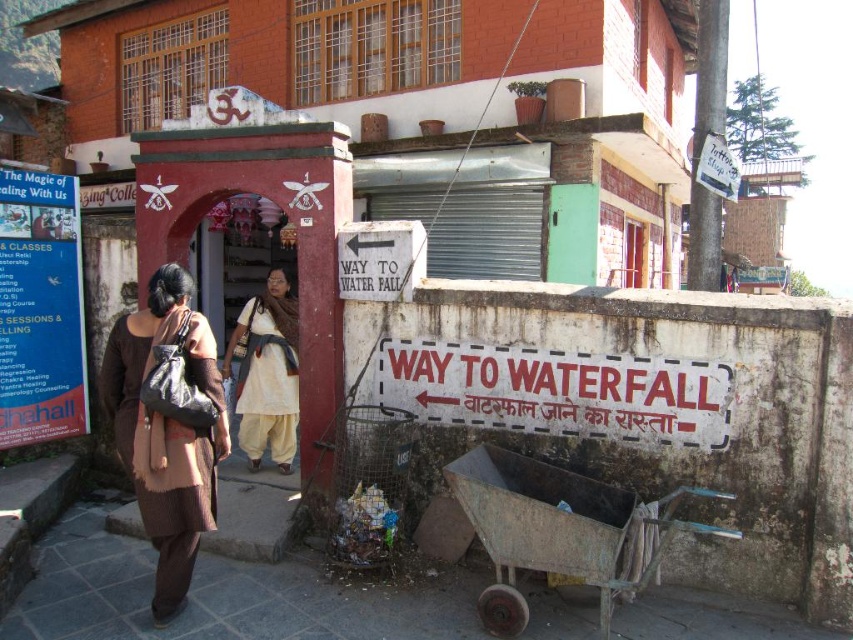
Does rusty metal cart at lower center have a smaller size compared to white cotton dress at center?

No, rusty metal cart at lower center is not smaller than white cotton dress at center.

Is rusty metal cart at lower center above white cotton dress at center?

No, rusty metal cart at lower center is not above white cotton dress at center.

Does point (624, 586) come behind point (238, 376)?

That is False.

Locate an element on the screen. rusty metal cart at lower center is located at coordinates (561, 531).

Does blue paper sign at left have a greater width compared to white cotton dress at center?

Incorrect, blue paper sign at left's width does not surpass white cotton dress at center's.

Is point (1, 445) in front of point (263, 371)?

Yes.

This screenshot has width=853, height=640. I want to click on blue paper sign at left, so click(39, 308).

What do you see at coordinates (167, 426) in the screenshot? Image resolution: width=853 pixels, height=640 pixels. I see `brown textured dress at left` at bounding box center [167, 426].

Looking at this image, does brown textured dress at left have a lesser width compared to blue paper sign at left?

No, brown textured dress at left is not thinner than blue paper sign at left.

Is point (184, 509) more distant than point (10, 400)?

No, (184, 509) is in front of (10, 400).

Identify the location of brown textured dress at left. (167, 426).